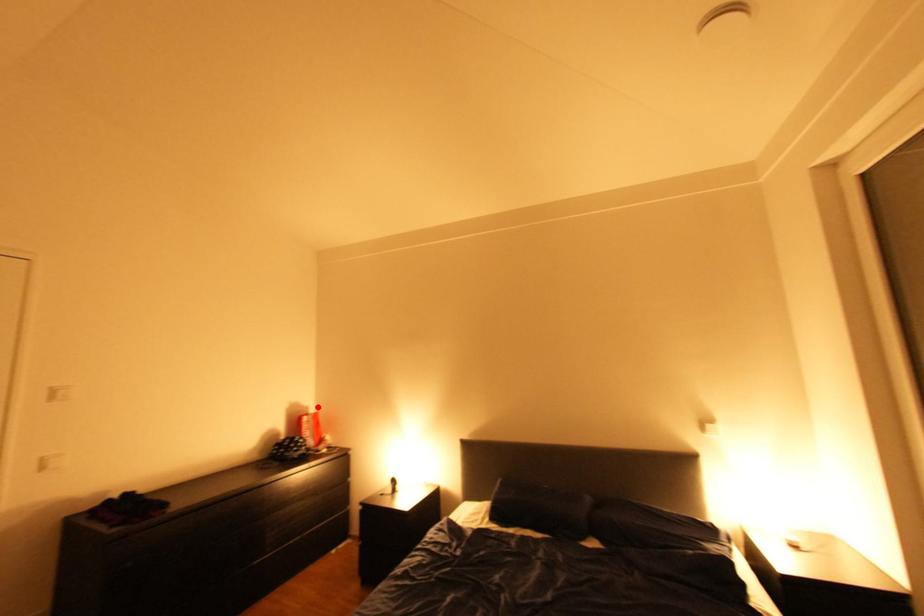
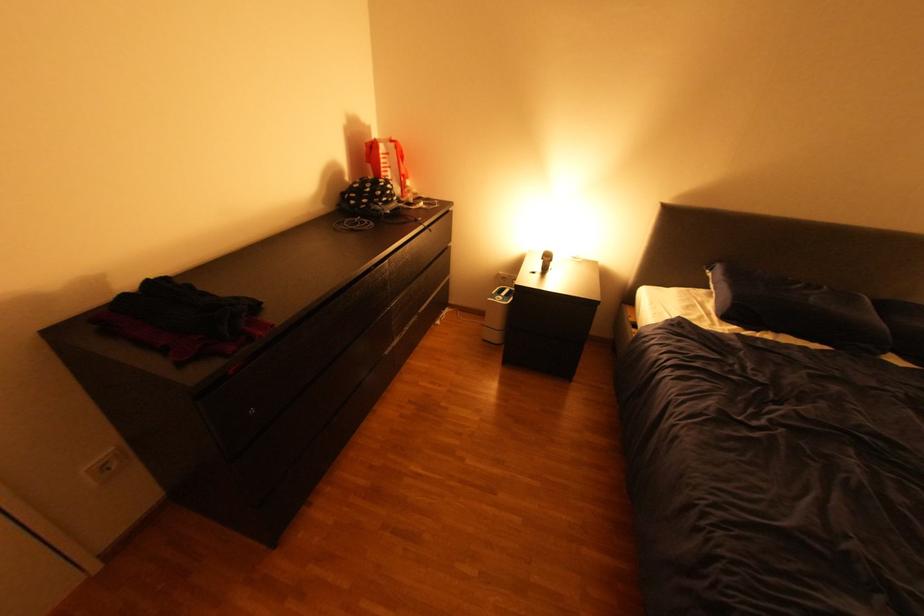
Question: I am providing you with two images of the same scene from different viewpoints. In image1, a red point is highlighted. Considering the same 3D point in image2, which of the following is correct?

Choices:
 (A) It is closer
 (B) It is farther

Answer: (A)